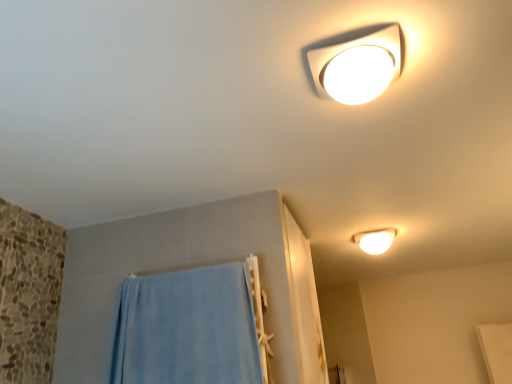
Question: Does white glossy lamp at upper center, acting as the second lamp starting from the back, have a lesser width compared to white glossy light fixture at upper right, which is counted as the 2th lamp, starting from the top?

Choices:
 (A) yes
 (B) no

Answer: (A)

Question: Does white glossy lamp at upper center, placed as the 2th lamp when sorted from bottom to top, have a greater width compared to white glossy light fixture at upper right, the 1th lamp from the bottom?

Choices:
 (A) yes
 (B) no

Answer: (B)

Question: Does white glossy lamp at upper center, which is the first lamp in left-to-right order, turn towards white glossy light fixture at upper right, acting as the first lamp starting from the right?

Choices:
 (A) yes
 (B) no

Answer: (A)

Question: Considering the relative positions of white glossy lamp at upper center, placed as the 2th lamp when sorted from bottom to top, and white glossy light fixture at upper right, arranged as the 2th lamp when viewed from the front, in the image provided, is white glossy lamp at upper center, placed as the 2th lamp when sorted from bottom to top, behind white glossy light fixture at upper right, arranged as the 2th lamp when viewed from the front,?

Choices:
 (A) no
 (B) yes

Answer: (A)

Question: From the image's perspective, would you say white glossy lamp at upper center, the 1th lamp positioned from the top, is shown under white glossy light fixture at upper right, which is counted as the 2th lamp, starting from the top?

Choices:
 (A) no
 (B) yes

Answer: (A)

Question: Considering the positions of white glossy light fixture at upper right, which is counted as the 2th lamp, starting from the top, and white glossy lamp at upper center, which is the first lamp in left-to-right order, in the image, is white glossy light fixture at upper right, which is counted as the 2th lamp, starting from the top, wider or thinner than white glossy lamp at upper center, which is the first lamp in left-to-right order,?

Choices:
 (A) wide
 (B) thin

Answer: (A)

Question: Would you say white glossy light fixture at upper right, the 1th lamp from the bottom, is inside or outside white glossy lamp at upper center, acting as the second lamp starting from the back?

Choices:
 (A) inside
 (B) outside

Answer: (B)

Question: In terms of height, does white glossy light fixture at upper right, which is counted as the 2th lamp, starting from the top, look taller or shorter compared to white glossy lamp at upper center, acting as the second lamp starting from the back?

Choices:
 (A) tall
 (B) short

Answer: (A)

Question: Considering their positions, is white glossy light fixture at upper right, which ranks as the 2th lamp in left-to-right order, located in front of or behind white glossy lamp at upper center, which is the first lamp in left-to-right order?

Choices:
 (A) front
 (B) behind

Answer: (B)

Question: From a real-world perspective, is white glossy lamp at upper center, placed as the 2th lamp when sorted from bottom to top, physically located above or below blue soft towel at lower left?

Choices:
 (A) below
 (B) above

Answer: (B)

Question: In terms of height, does white glossy lamp at upper center, which ranks as the 1th lamp in front-to-back order, look taller or shorter compared to blue soft towel at lower left?

Choices:
 (A) tall
 (B) short

Answer: (B)

Question: Looking at their shapes, would you say white glossy lamp at upper center, which is the first lamp in left-to-right order, is wider or thinner than blue soft towel at lower left?

Choices:
 (A) wide
 (B) thin

Answer: (A)

Question: From the image's perspective, is white glossy lamp at upper center, acting as the second lamp starting from the back, positioned above or below blue soft towel at lower left?

Choices:
 (A) above
 (B) below

Answer: (A)

Question: Which is correct: blue soft towel at lower left is inside white glossy light fixture at upper right, arranged as the 2th lamp when viewed from the front, or outside of it?

Choices:
 (A) inside
 (B) outside

Answer: (B)

Question: Looking at their shapes, would you say blue soft towel at lower left is wider or thinner than white glossy light fixture at upper right, arranged as the 2th lamp when viewed from the front?

Choices:
 (A) wide
 (B) thin

Answer: (B)